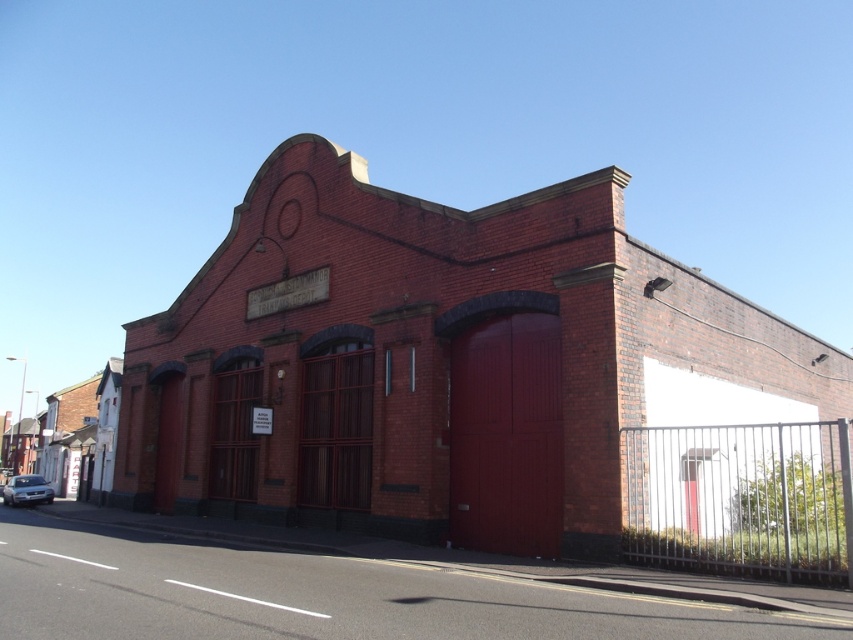
Question: Is brick fire station at center further to camera compared to satin silver car at lower left?

Choices:
 (A) no
 (B) yes

Answer: (A)

Question: Which object is closer to the camera taking this photo?

Choices:
 (A) brick fire station at center
 (B) satin silver car at lower left

Answer: (A)

Question: Is brick fire station at center to the left of satin silver car at lower left from the viewer's perspective?

Choices:
 (A) yes
 (B) no

Answer: (B)

Question: Is brick fire station at center positioned before satin silver car at lower left?

Choices:
 (A) yes
 (B) no

Answer: (A)